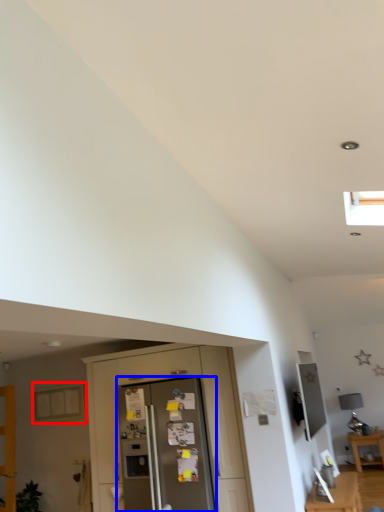
Question: Which object appears farthest to the camera in this image, window (highlighted by a red box) or screen door (highlighted by a blue box)?

Choices:
 (A) window
 (B) screen door

Answer: (A)